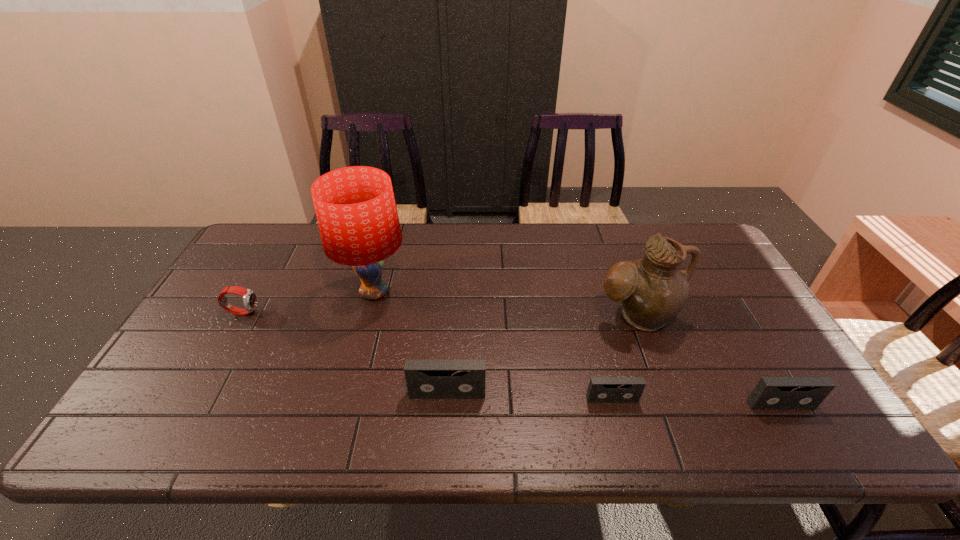
The width and height of the screenshot is (960, 540). Find the location of `the tallest videotape`. the tallest videotape is located at coordinates (426, 379).

What are the coordinates of `the third tallest object` in the screenshot? It's located at (426, 379).

Where is `the shortest object`? The image size is (960, 540). the shortest object is located at coordinates (601, 389).

The width and height of the screenshot is (960, 540). I want to click on the shortest videotape, so click(x=601, y=389).

In order to click on the second tallest videotape in this screenshot , I will do `click(771, 393)`.

The width and height of the screenshot is (960, 540). Find the location of `the rightmost videotape`. the rightmost videotape is located at coordinates (771, 393).

Identify the location of the tallest object. (355, 206).

Identify the location of lampshade. (355, 206).

The image size is (960, 540). Find the location of `the fifth shortest object`. the fifth shortest object is located at coordinates (652, 290).

Identify the location of the leftmost object. The width and height of the screenshot is (960, 540). (249, 297).